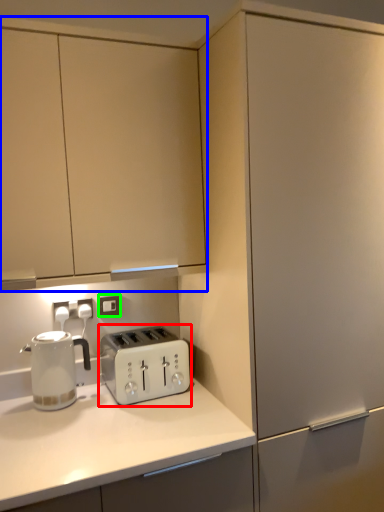
Question: Estimate the real-world distances between objects in this image. Which object is farther from toaster (highlighted by a red box), cabinetry (highlighted by a blue box) or electric outlet (highlighted by a green box)?

Choices:
 (A) cabinetry
 (B) electric outlet

Answer: (A)